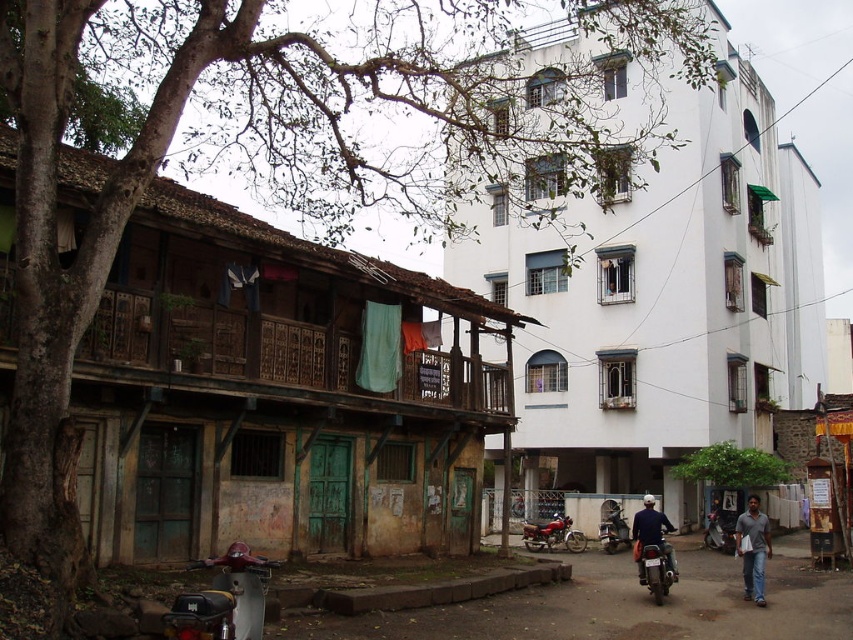
You are standing at the point marked by the coordinates point (654,566) which is the shiny metallic motorcycle at lower right. Looking towards the building with wooden balcony railings on its upper level, which direction should you turn to face it?

You should turn to your left to face the building with wooden balcony railings on its upper level because the shiny metallic motorcycle at lower right is located to the right of the building.

You are a delivery person who needs to park your motorcycle in a spot that is exactly 1.5 meters wide. The shiny metallic motorcycle at lower right and the shiny red motorcycle at center are already parked. Which motorcycle can you park next to without overlapping?

The shiny metallic motorcycle at lower right has a greater height compared to the shiny red motorcycle at center. Since the parking spot is 1.5 meters wide, you should park next to the shiny red motorcycle at center, as it is shorter and less likely to block the space.